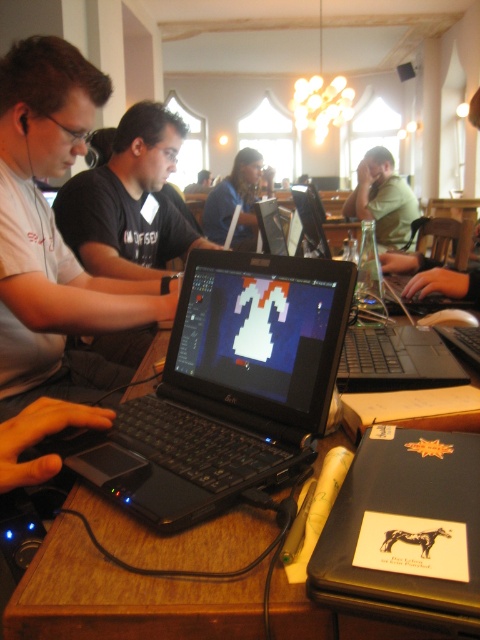
Between point (84, 464) and point (380, 172), which one is positioned in front?

Point (84, 464)

Between point (194, 499) and point (398, 179), which one is positioned behind?

The point (398, 179) is behind.

Which is in front, point (216, 333) or point (384, 244)?

Point (216, 333)

Where is `black plastic laptop at center`? Image resolution: width=480 pixels, height=640 pixels. black plastic laptop at center is located at coordinates (227, 388).

Who is more forward, (360, 208) or (440, 221)?

Point (440, 221) is in front.

Does green matte shirt at center have a larger size compared to black glossy laptop at center?

Yes.

The height and width of the screenshot is (640, 480). Describe the element at coordinates (383, 198) in the screenshot. I see `green matte shirt at center` at that location.

Find the location of a particular element. The image size is (480, 640). green matte shirt at center is located at coordinates (383, 198).

Describe the element at coordinates (393, 364) in the screenshot. The image size is (480, 640). I see `black matte laptop at center` at that location.

Measure the distance from black matte laptop at center to black glossy laptop at center.

46.93 centimeters

Who is more forward, (452, 381) or (479, 296)?

Positioned in front is point (452, 381).

Image resolution: width=480 pixels, height=640 pixels. In order to click on black matte laptop at center in this screenshot , I will do `click(393, 364)`.